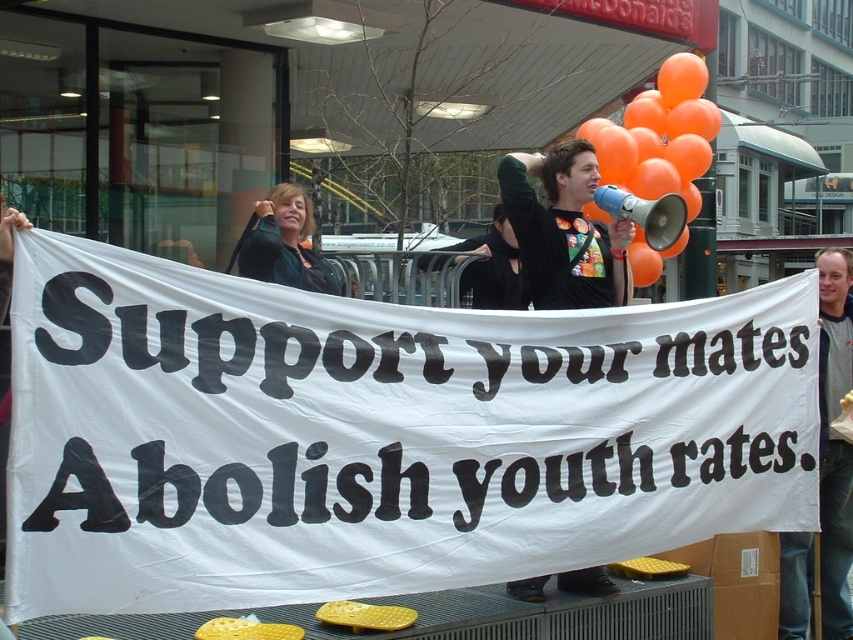
Question: Among these objects, which one is nearest to the camera?

Choices:
 (A) matte black jacket at upper center
 (B) white paper banner at center
 (C) orange matte balloons at upper right

Answer: (B)

Question: Is orange matte balloons at upper right closer to the viewer compared to matte black jacket at upper center?

Choices:
 (A) no
 (B) yes

Answer: (A)

Question: Which point is closer to the camera taking this photo?

Choices:
 (A) (308, 209)
 (B) (640, 262)
 (C) (167, 554)

Answer: (C)

Question: Can you confirm if orange matte balloons at upper right is positioned to the left of matte black jacket at upper center?

Choices:
 (A) no
 (B) yes

Answer: (A)

Question: Which of the following is the closest to the observer?

Choices:
 (A) orange matte balloons at upper right
 (B) white paper banner at center

Answer: (B)

Question: Is orange matte balloons at upper right thinner than matte black jacket at upper center?

Choices:
 (A) no
 (B) yes

Answer: (A)